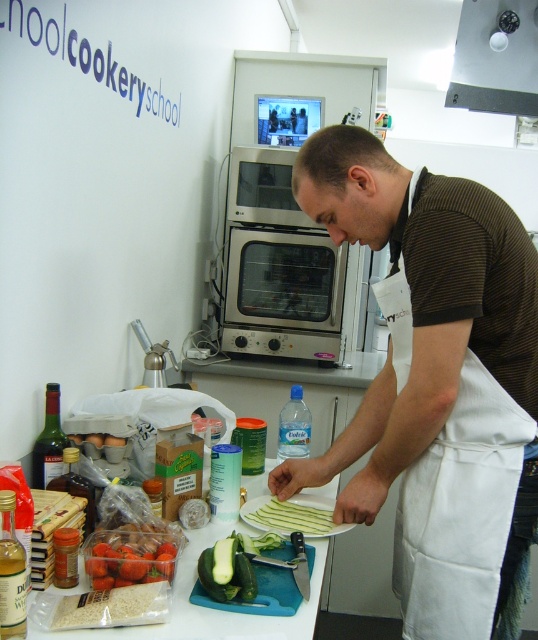
You are a chef in a cookery school. You need to reach the translucent glass bottle at left to grab some olive oil. Is the metallic gray exhaust hood at upper center in your way?

The metallic gray exhaust hood at upper center is above the translucent glass bottle at left, so it is not blocking your path to the bottle.

You are a student in the cookery school and need to choose a bottle to pour olive oil. The translucent glass bottle at center and the blue plastic water bottle at center are both on the counter. Which one is more likely to be the olive oil container?

The translucent glass bottle at center is more likely to be the olive oil container because it has a smaller size compared to the blue plastic water bottle at center, and olive oil is typically stored in smaller glass bottles.

You are a chef standing in the cookery school kitchen. You need to reach both the point at coordinates (x=533, y=68) and the point at (x=56, y=483). Which point will you reach first?

You will reach point (x=533, y=68) first because it is closer to you than point (x=56, y=483), which is further away.